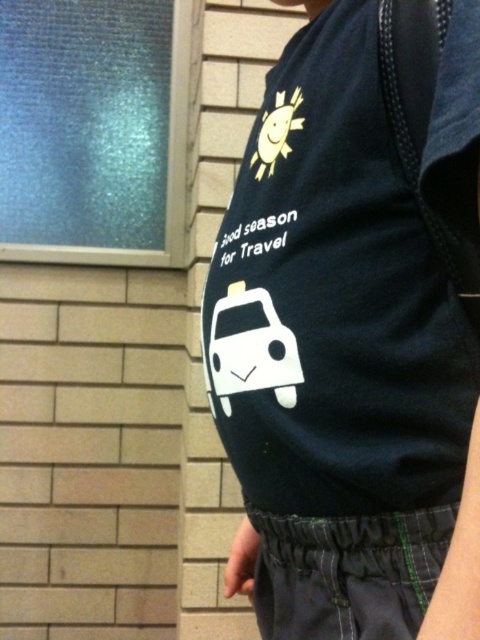
You are standing in front of the person wearing the dark blue tshirt. You want to move from the point at coordinate point (x=308, y=516) to the point at coordinate point (x=289, y=560). Which direction should you move to get closer to the second point?

To move from point (x=308, y=516) to point (x=289, y=560), you should move to the right and slightly downward since the second point has a higher x coordinate and lower y coordinate than the first point.